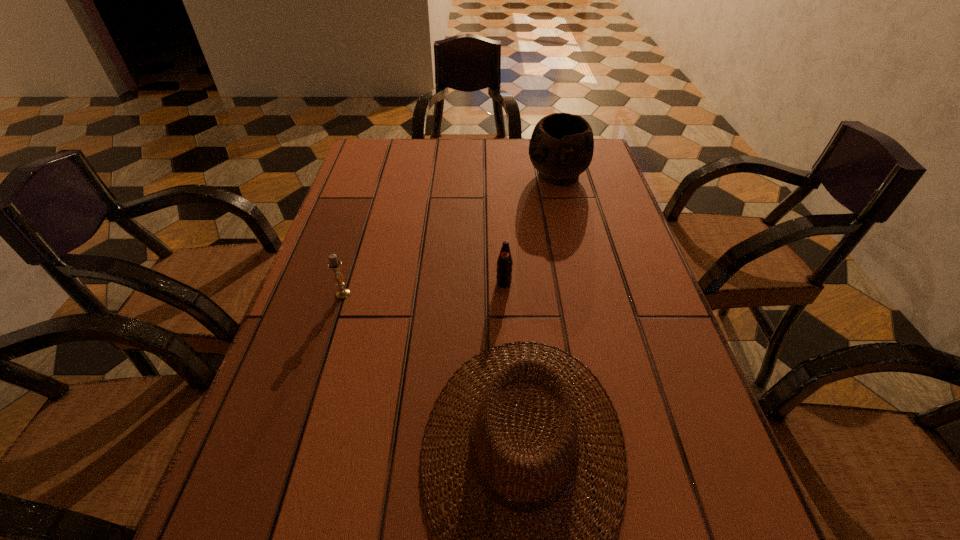
At what (x,y) coordinates should I click in order to perform the action: click on object located in the right edge section of the desktop. Please return your answer as a coordinate pair (x, y). This screenshot has height=540, width=960. Looking at the image, I should click on tap(561, 147).

Identify the location of object located at the far right corner. (561, 147).

I want to click on free space at the far edge of the desktop, so click(514, 138).

Find the location of a particular element. The image size is (960, 540). vacant space at the left edge of the desktop is located at coordinates (310, 284).

Find the location of a particular element. The image size is (960, 540). vacant space at the right edge of the desktop is located at coordinates (610, 294).

The height and width of the screenshot is (540, 960). Find the location of `free region at the far left corner of the desktop`. free region at the far left corner of the desktop is located at coordinates coord(391,164).

Identify the location of free space at the far right corner. This screenshot has height=540, width=960. (596, 160).

At what (x,y) coordinates should I click in order to perform the action: click on empty space that is in between the pottery and the pop. Please return your answer as a coordinate pair (x, y). Looking at the image, I should click on (531, 230).

Locate an element on the screen. Image resolution: width=960 pixels, height=540 pixels. empty space between the third farthest object and the pop is located at coordinates (423, 288).

This screenshot has width=960, height=540. Find the location of `vacant region between the second farthest object and the third farthest object`. vacant region between the second farthest object and the third farthest object is located at coordinates (423, 288).